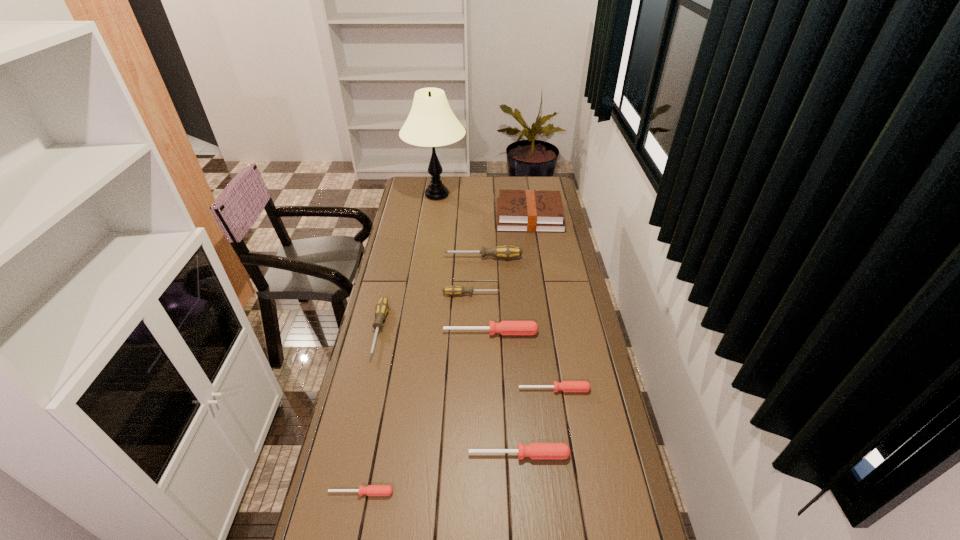
Find the location of `red screwdriver identified as the third closest to the second farthest red screwdriver`. red screwdriver identified as the third closest to the second farthest red screwdriver is located at coordinates (371, 490).

Locate an element on the screen. This screenshot has width=960, height=540. vacant space that satisfies the following two spatial constraints: 1. at the tip of the fourth farthest object; 2. at the tip of the leftmost gray screwdriver is located at coordinates (470, 330).

Where is `vacant space that satisfies the following two spatial constraints: 1. at the tip of the farthest screwdriver; 2. at the tip of the nearest gray screwdriver`? This screenshot has width=960, height=540. vacant space that satisfies the following two spatial constraints: 1. at the tip of the farthest screwdriver; 2. at the tip of the nearest gray screwdriver is located at coordinates (483, 330).

Locate an element on the screen. This screenshot has width=960, height=540. free spot that satisfies the following two spatial constraints: 1. at the tip of the third nearest screwdriver; 2. on the right side of the farthest screwdriver is located at coordinates (484, 389).

Locate an element on the screen. This screenshot has width=960, height=540. vacant area in the image that satisfies the following two spatial constraints: 1. at the tip of the smallest gray screwdriver; 2. on the back side of the biggest red screwdriver is located at coordinates (470, 333).

Locate an element on the screen. vacant space that satisfies the following two spatial constraints: 1. at the tip of the farthest red screwdriver; 2. on the right side of the fourth farthest object is located at coordinates (470, 333).